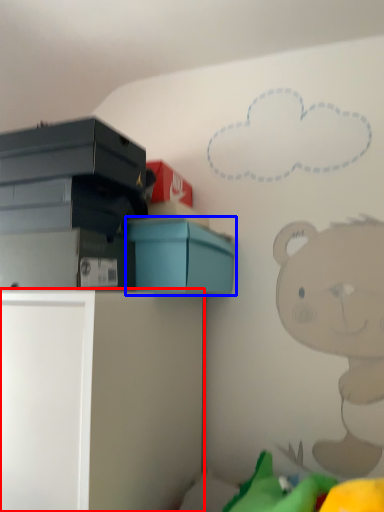
Question: Which of the following is the closest to the observer, furniture (highlighted by a red box) or box (highlighted by a blue box)?

Choices:
 (A) furniture
 (B) box

Answer: (A)